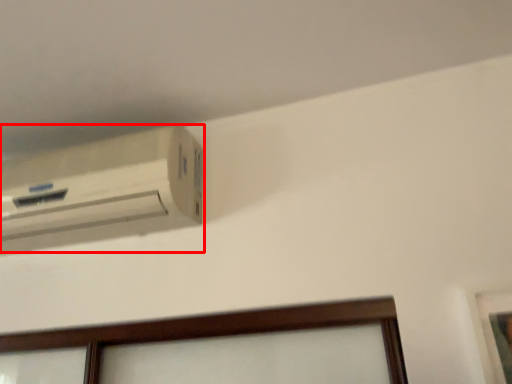
Question: From the image's perspective, where is air conditioning (annotated by the red box) located in relation to picture frame in the image?

Choices:
 (A) below
 (B) above

Answer: (B)